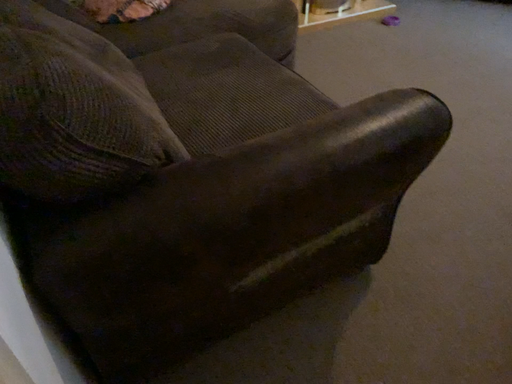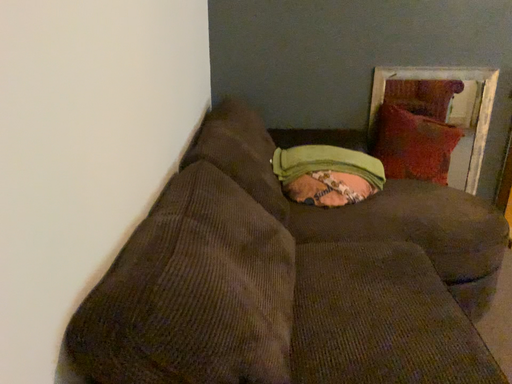
Question: Which way did the camera rotate in the video?

Choices:
 (A) rotated downward
 (B) rotated upward

Answer: (B)